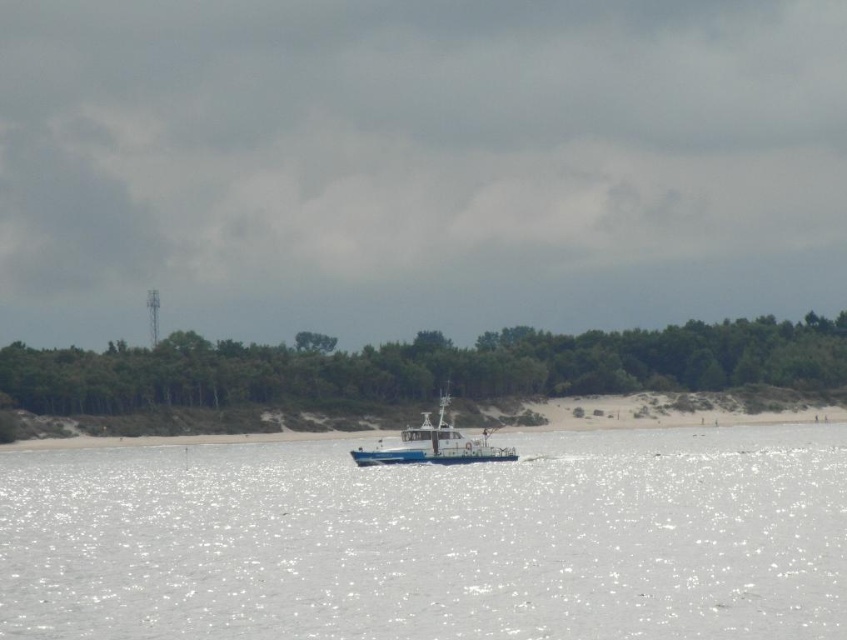
Which is more to the right, white glossy water at center or white glossy boat at center?

white glossy water at center

Does point (363, 477) come closer to viewer compared to point (462, 460)?

Yes, point (363, 477) is closer to viewer.

Image resolution: width=847 pixels, height=640 pixels. In order to click on white glossy water at center in this screenshot , I will do `click(432, 540)`.